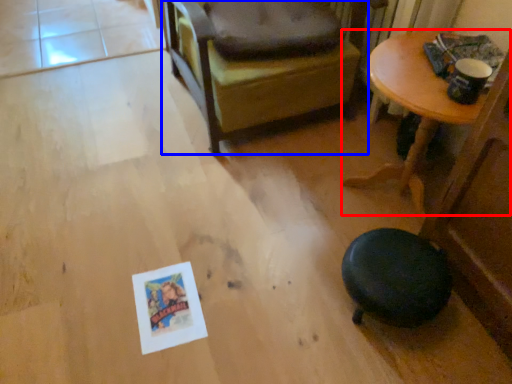
Question: Which object is closer to the camera taking this photo, table (highlighted by a red box) or chair (highlighted by a blue box)?

Choices:
 (A) table
 (B) chair

Answer: (A)